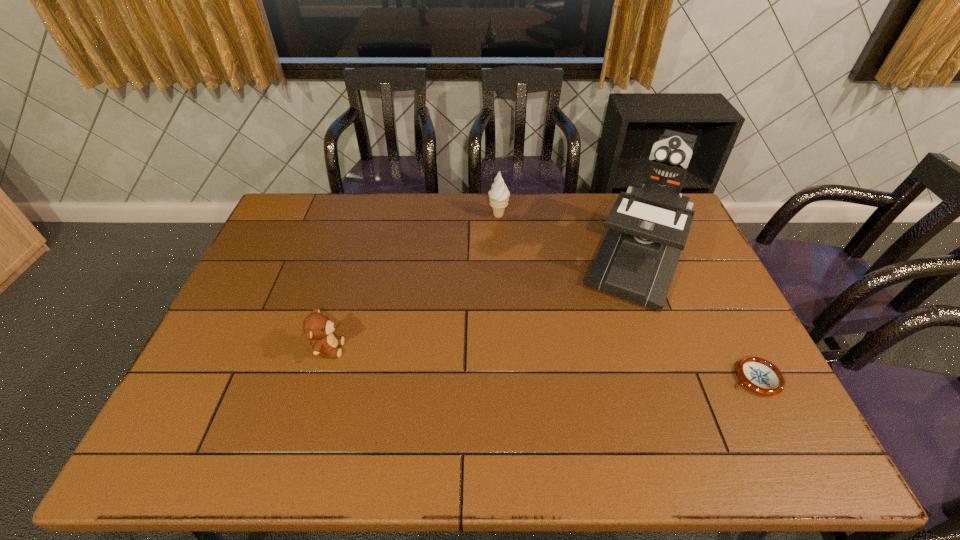
Identify the location of the second shortest object. The height and width of the screenshot is (540, 960). (317, 328).

Where is `teddy bear`? teddy bear is located at coordinates (317, 328).

This screenshot has width=960, height=540. In order to click on the shortest object in this screenshot , I will do `click(759, 375)`.

This screenshot has height=540, width=960. Identify the location of icecream. (498, 195).

Locate an element on the screen. the third shortest object is located at coordinates (498, 195).

This screenshot has height=540, width=960. What are the coordinates of `microscope` in the screenshot? It's located at (648, 225).

This screenshot has width=960, height=540. In order to click on free spot located 0.190m on the face of the second shortest object in this screenshot , I will do [415, 349].

This screenshot has width=960, height=540. I want to click on free location located 0.300m on the left of the shortest object, so click(612, 378).

The image size is (960, 540). I want to click on vacant space situated 0.340m on the front-facing side of the third object from right to left, so click(x=539, y=287).

Find the location of a particular element. free space located 0.280m on the front-facing side of the third object from right to left is located at coordinates (531, 273).